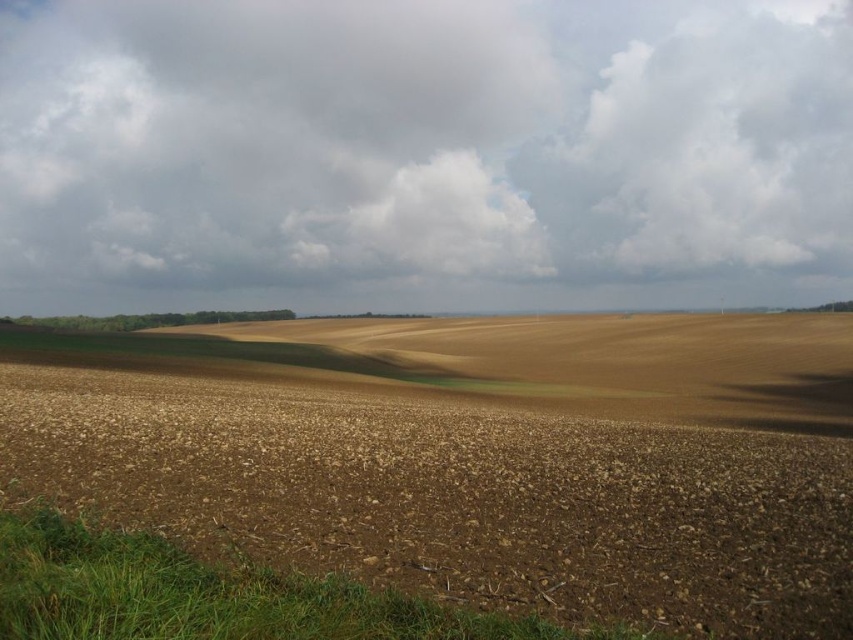
Which is behind, point (259, 250) or point (560, 541)?

Positioned behind is point (259, 250).

Does cloudy sky at upper center appear on the right side of brown soil at center?

Incorrect, cloudy sky at upper center is not on the right side of brown soil at center.

Who is more forward, (374, 76) or (848, 348)?

Positioned in front is point (848, 348).

At what (x,y) coordinates should I click in order to perform the action: click on cloudy sky at upper center. Please return your answer as a coordinate pair (x, y). The height and width of the screenshot is (640, 853). Looking at the image, I should click on (422, 154).